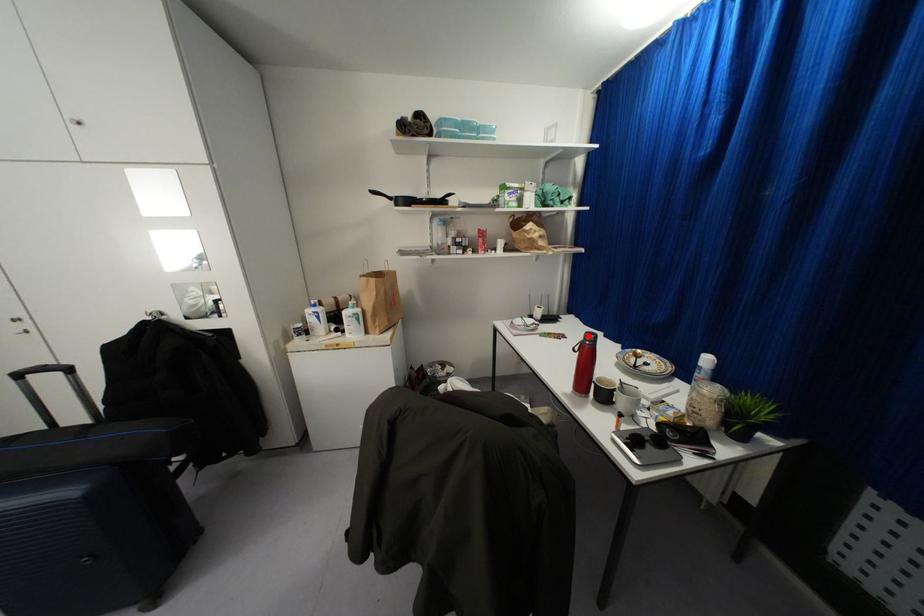
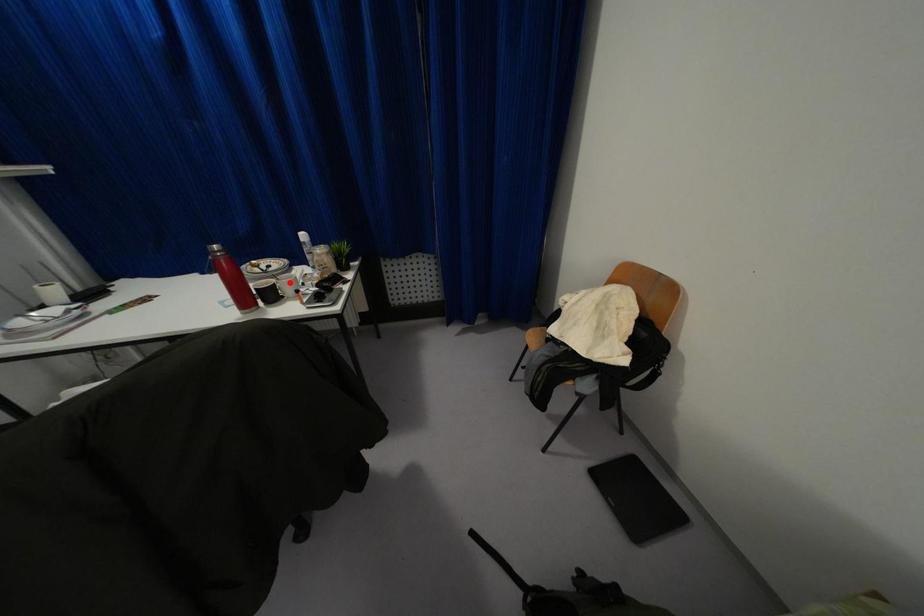
I am providing you with two images of the same scene from different viewpoints. A red point is marked on the first image and another point is marked on the second image. Are the points marked in image1 and image2 representing the same 3D position?

No